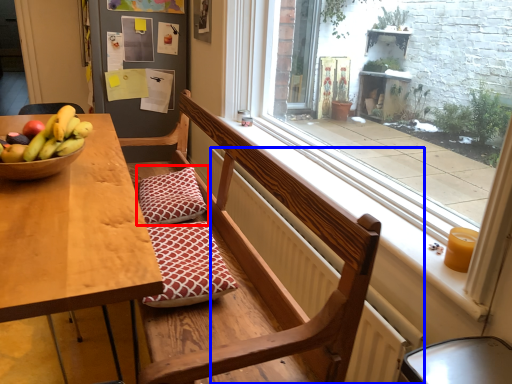
Question: Which of the following is the closest to the observer, pillow (highlighted by a red box) or radiator (highlighted by a blue box)?

Choices:
 (A) pillow
 (B) radiator

Answer: (B)